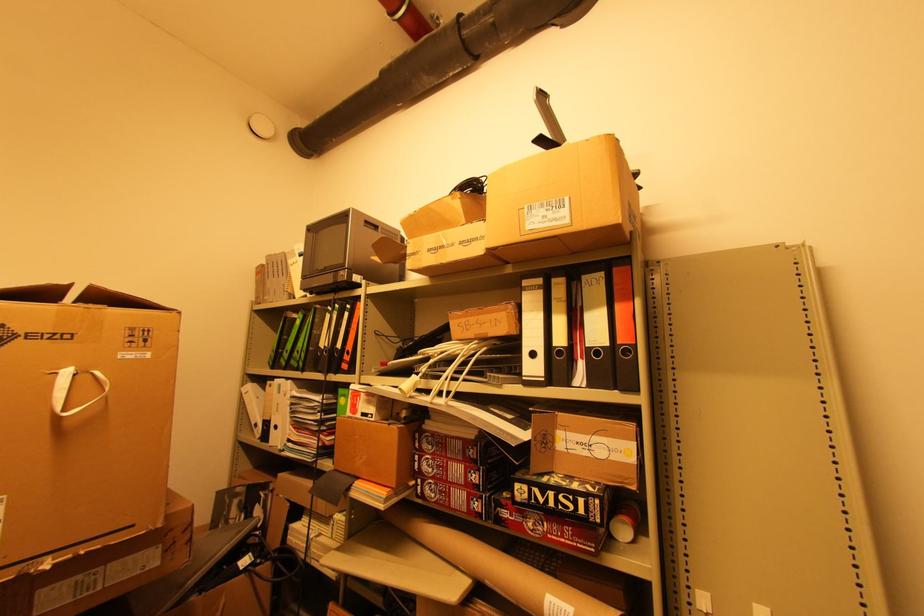
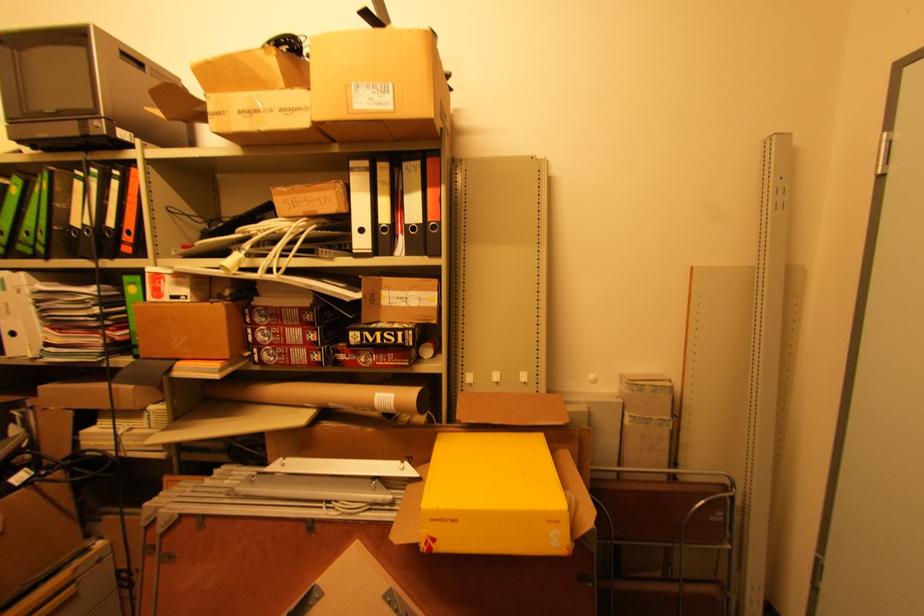
Locate, in the second image, the point that corresponds to point 416,484 in the first image.

(251, 354)